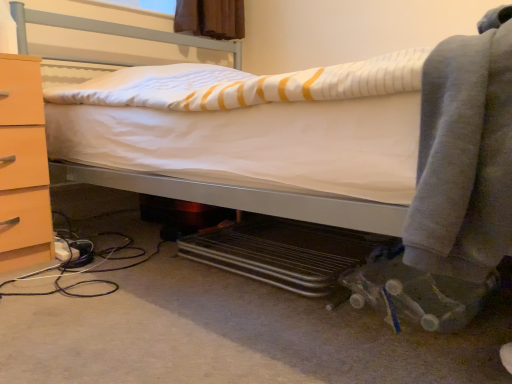
Question: Choose the correct answer: Is gray fleece blanket at lower right inside matte wood chest of drawers at left or outside it?

Choices:
 (A) inside
 (B) outside

Answer: (B)

Question: Is gray fleece blanket at lower right taller or shorter than matte wood chest of drawers at left?

Choices:
 (A) short
 (B) tall

Answer: (A)

Question: In terms of width, does gray fleece blanket at lower right look wider or thinner when compared to matte wood chest of drawers at left?

Choices:
 (A) thin
 (B) wide

Answer: (B)

Question: Looking at the image, does matte wood chest of drawers at left seem bigger or smaller compared to gray fleece blanket at lower right?

Choices:
 (A) small
 (B) big

Answer: (B)

Question: From the image's perspective, is matte wood chest of drawers at left located above or below gray fleece blanket at lower right?

Choices:
 (A) below
 (B) above

Answer: (A)

Question: From a real-world perspective, relative to gray fleece blanket at lower right, is matte wood chest of drawers at left vertically above or below?

Choices:
 (A) above
 (B) below

Answer: (B)

Question: Looking at their shapes, would you say matte wood chest of drawers at left is wider or thinner than gray fleece blanket at lower right?

Choices:
 (A) wide
 (B) thin

Answer: (B)